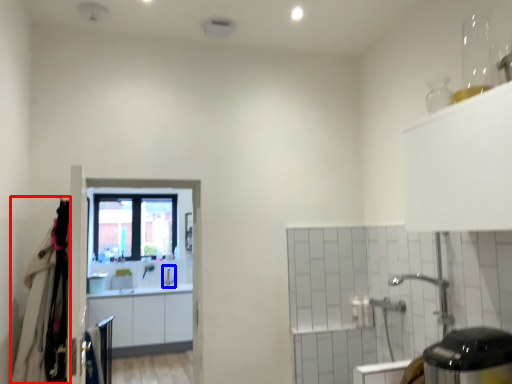
Question: Which point is further to the camera, laundry (highlighted by a red box) or faucet (highlighted by a blue box)?

Choices:
 (A) laundry
 (B) faucet

Answer: (B)